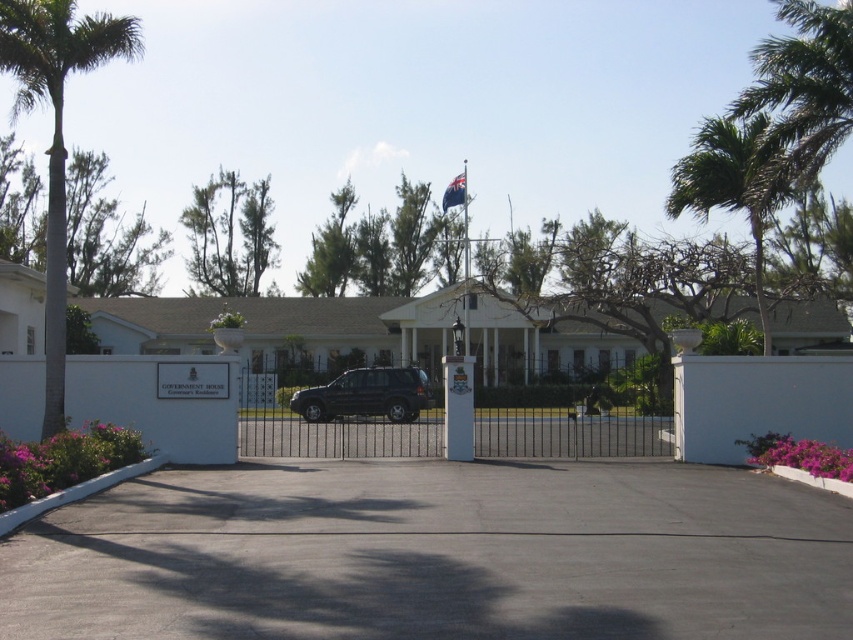
You are a visitor arriving at Government House and need to park your car. The parking lot is located behind the green leafy palm tree at left. Can you drive straight through the open gate along the black asphalt driveway at center to reach the parking lot?

The black asphalt driveway at center is closer to the viewer than the green leafy palm tree at left, so you can drive straight through the open gate along the black asphalt driveway at center to reach the parking lot behind the green leafy palm tree at left.

You are a delivery driver with a truck that is 2 meters wide. You need to enter Government House through the open gate. Based on the scene, can your truck pass through the gap between the green leafy palm tree at left and the shiny black suv at center?

The green leafy palm tree at left might be wider than the shiny black suv at center, so the gap between them may not be wide enough for a 2 meter wide truck. You should check the width before attempting to pass.